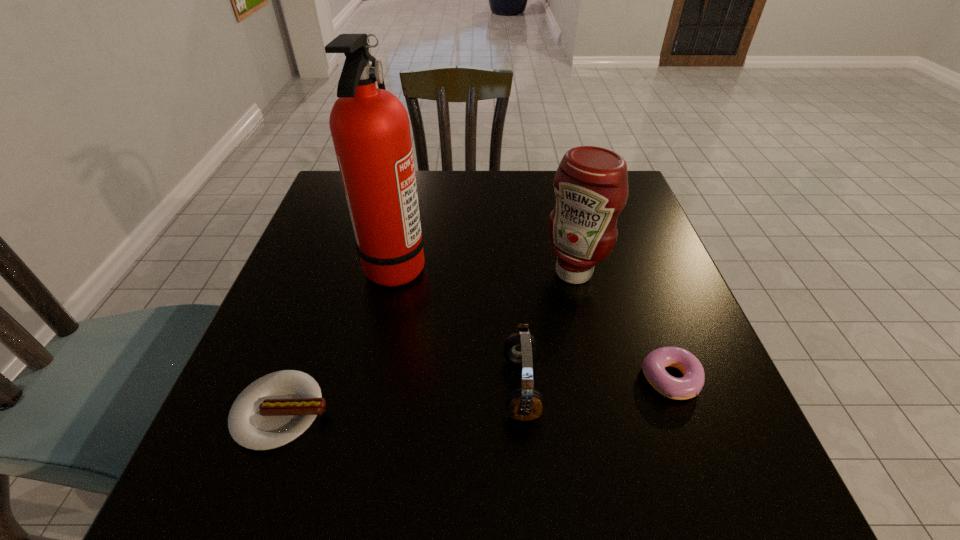
Find the location of `vacant space that is in between the tallest object and the headset`. vacant space that is in between the tallest object and the headset is located at coordinates (459, 326).

The image size is (960, 540). I want to click on unoccupied area between the condiment and the doughnut, so click(x=622, y=326).

Locate an element on the screen. The image size is (960, 540). blank region between the sausage and the fire extinguisher is located at coordinates (339, 338).

In order to click on free space between the tallest object and the third tallest object in this screenshot , I will do `click(459, 326)`.

Identify which object is the fourth nearest to the second object from right to left. Please provide its 2D coordinates. Your answer should be formatted as a tuple, i.e. [(x, y)], where the tuple contains the x and y coordinates of a point satisfying the conditions above.

[(274, 410)]

Identify the location of the third closest object relative to the tallest object. (591, 183).

The width and height of the screenshot is (960, 540). Find the location of `free location that satisfies the following two spatial constraints: 1. on the handle side of the second object from right to left; 2. on the left side of the tallest object`. free location that satisfies the following two spatial constraints: 1. on the handle side of the second object from right to left; 2. on the left side of the tallest object is located at coordinates (395, 273).

I want to click on vacant point that satisfies the following two spatial constraints: 1. on the handle side of the condiment; 2. on the right side of the tallest object, so click(395, 273).

Locate an element on the screen. The height and width of the screenshot is (540, 960). vacant space that satisfies the following two spatial constraints: 1. on the back side of the fourth object from left to right; 2. on the handle side of the tallest object is located at coordinates (572, 265).

I want to click on vacant space that satisfies the following two spatial constraints: 1. on the handle side of the tallest object; 2. on the left side of the second tallest object, so click(x=395, y=273).